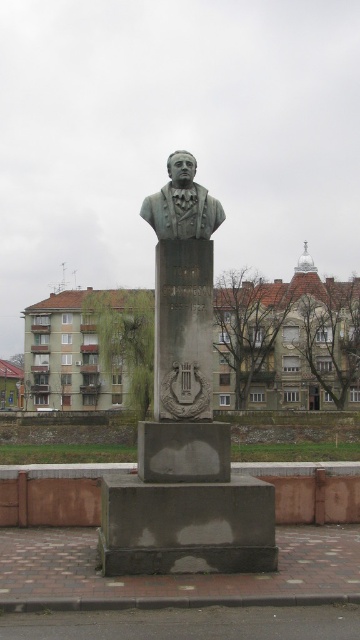
You are an art conservator examining the bronze bust monument in the public square. You notice two different descriptions of the bust in your notes. One says it is a green polished bust at center, and the other mentions a green patina bust at center. Based on the spatial relationship between these two descriptions, which one is more likely to be accurate?

The green polished bust at center is taller than the green patina bust at center. Since the polished version is described as taller, it might be the actual bust on the monument, as patina usually forms on the surface over time and doesn

You are an art student analyzing the monument in the public square. You notice two versions of the bust displayed on the pedestal. Which one, the green polished bust at center or the green patina bust at center, is bigger in size?

The green polished bust at center has a larger size compared to the green patina bust at center.